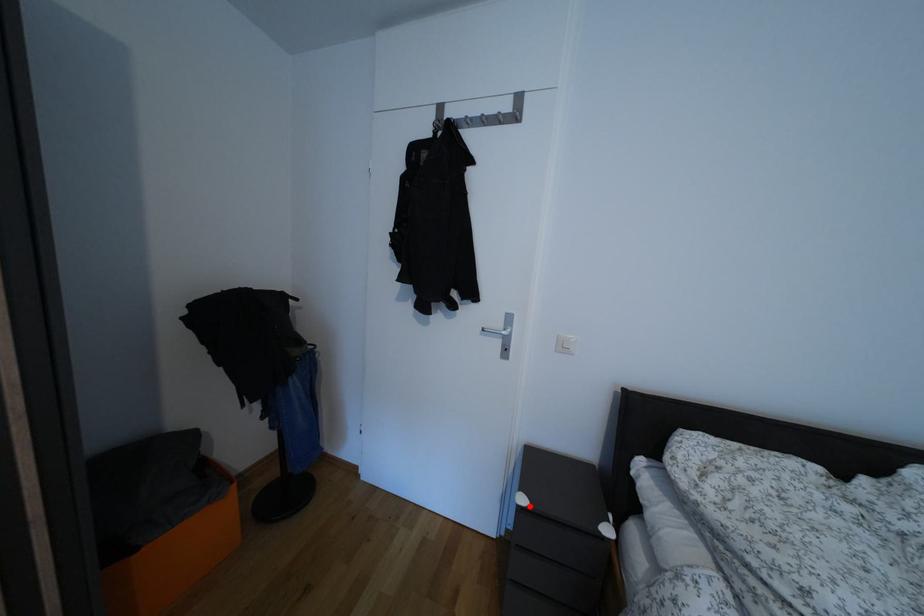
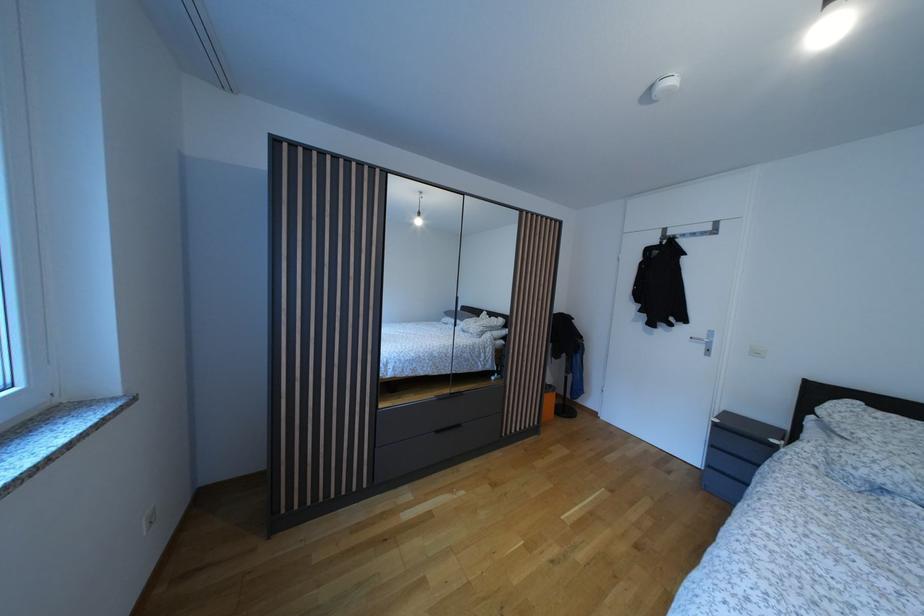
Question: I am providing you with two images of the same scene from different viewpoints. A red point is marked on the first image. At the location where the point appears in image 1, is it still visible in image 2?

Choices:
 (A) Yes
 (B) No

Answer: (A)